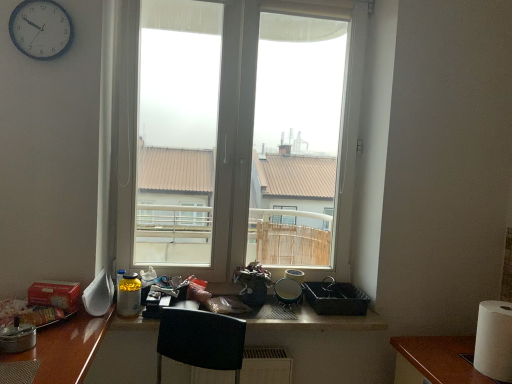
Question: Does black woven basket at lower right, the 4th appliance positioned from the left, lie behind white plastic clock at upper left?

Choices:
 (A) yes
 (B) no

Answer: (A)

Question: Is black woven basket at lower right, which is the first appliance in back-to-front order, thinner than white plastic clock at upper left?

Choices:
 (A) no
 (B) yes

Answer: (A)

Question: Considering the relative sizes of black woven basket at lower right, which is the first appliance in back-to-front order, and white plastic clock at upper left in the image provided, is black woven basket at lower right, which is the first appliance in back-to-front order, smaller than white plastic clock at upper left?

Choices:
 (A) yes
 (B) no

Answer: (B)

Question: From the image's perspective, is black woven basket at lower right, which is the first appliance in back-to-front order, below white plastic clock at upper left?

Choices:
 (A) no
 (B) yes

Answer: (B)

Question: Considering the relative positions of black woven basket at lower right, the 4th appliance positioned from the left, and white plastic clock at upper left in the image provided, is black woven basket at lower right, the 4th appliance positioned from the left, to the left of white plastic clock at upper left from the viewer's perspective?

Choices:
 (A) no
 (B) yes

Answer: (A)

Question: Could you tell me if black woven basket at lower right, which is counted as the 1th appliance, starting from the right, is turned towards white plastic clock at upper left?

Choices:
 (A) no
 (B) yes

Answer: (A)

Question: Does black woven basket at lower right, positioned as the fourth appliance in front-to-back order, turn towards white glossy spoon at left, which appears as the second appliance when viewed from the front?

Choices:
 (A) no
 (B) yes

Answer: (B)

Question: Considering the relative sizes of black woven basket at lower right, which is counted as the 1th appliance, starting from the right, and white glossy spoon at left, the third appliance from the right, in the image provided, is black woven basket at lower right, which is counted as the 1th appliance, starting from the right, taller than white glossy spoon at left, the third appliance from the right,?

Choices:
 (A) no
 (B) yes

Answer: (A)

Question: Is black woven basket at lower right, which is counted as the 1th appliance, starting from the right, positioned far away from white glossy spoon at left, which appears as the second appliance when viewed from the front?

Choices:
 (A) yes
 (B) no

Answer: (B)

Question: Would you say black woven basket at lower right, which is the first appliance in back-to-front order, is outside white glossy spoon at left, the 3th appliance from the back?

Choices:
 (A) no
 (B) yes

Answer: (B)

Question: From a real-world perspective, is black woven basket at lower right, which is counted as the 1th appliance, starting from the right, beneath white glossy spoon at left, the 3th appliance from the back?

Choices:
 (A) no
 (B) yes

Answer: (B)

Question: Is the depth of black woven basket at lower right, which is counted as the 1th appliance, starting from the right, greater than that of white glossy spoon at left, the 3th appliance from the back?

Choices:
 (A) yes
 (B) no

Answer: (A)

Question: Can you confirm if black woven basket at lower right, which is counted as the 1th appliance, starting from the right, is smaller than metallic silver pot at left, the 1th appliance viewed from the left?

Choices:
 (A) no
 (B) yes

Answer: (A)